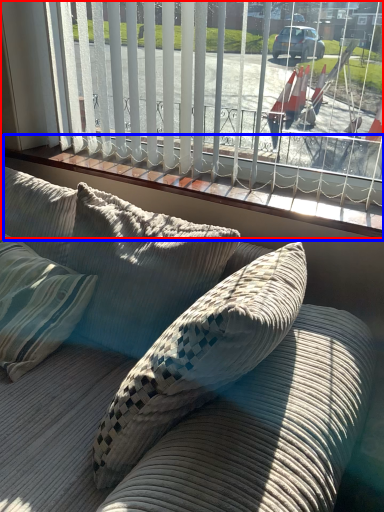
Question: Which point is closer to the camera, window (highlighted by a red box) or window sill (highlighted by a blue box)?

Choices:
 (A) window
 (B) window sill

Answer: (A)